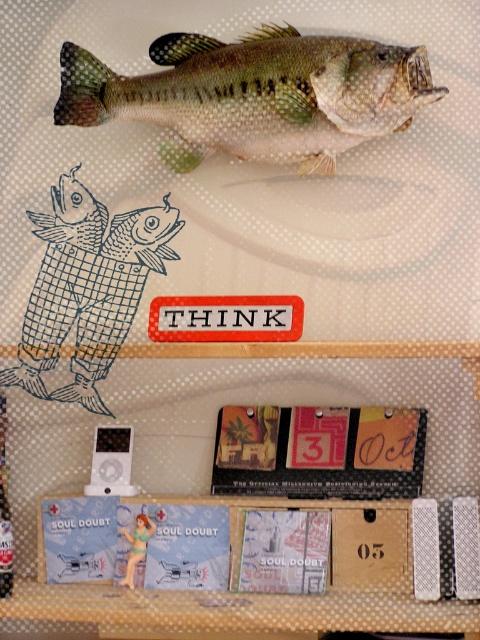
Question: From the image, what is the correct spatial relationship of green matte fish at upper center in relation to matte black calendar at center?

Choices:
 (A) below
 (B) above

Answer: (B)

Question: Which point is closer to the camera taking this photo?

Choices:
 (A) (147, 532)
 (B) (73, 104)

Answer: (B)

Question: Observing the image, what is the correct spatial positioning of blue checkered fish at upper left in reference to wooden box at center?

Choices:
 (A) left
 (B) right

Answer: (A)

Question: Can you confirm if blue checkered fish at upper left is wider than matte black calendar at center?

Choices:
 (A) yes
 (B) no

Answer: (B)

Question: Which point is farther to the camera?

Choices:
 (A) 181,80
 (B) 141,544
 (C) 386,611
 (D) 182,221

Answer: (D)

Question: Which point appears closest to the camera in this image?

Choices:
 (A) (132, 556)
 (B) (169, 616)

Answer: (B)